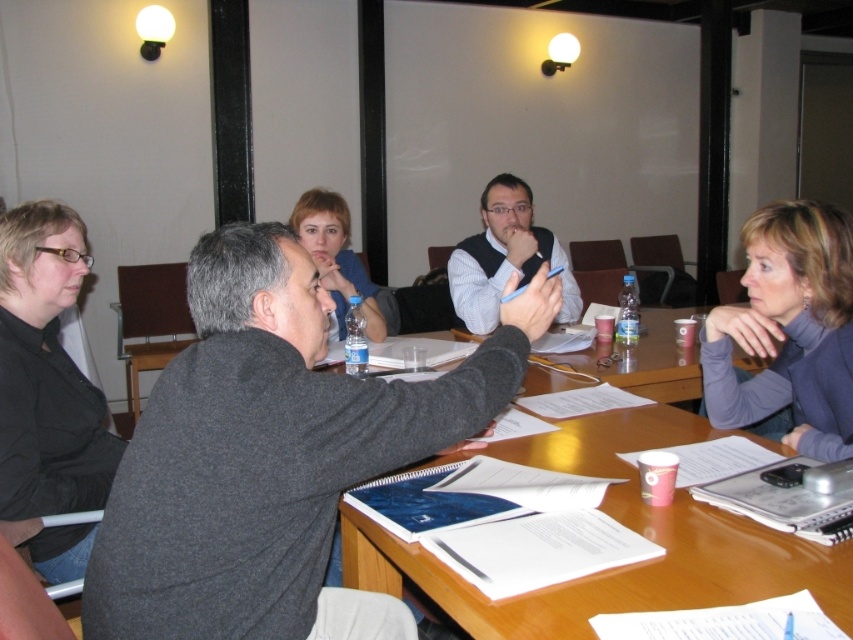
Does wooden table at center appear under matte blue shirt at center?

Yes.

Is wooden table at center bigger than matte blue shirt at center?

Correct, wooden table at center is larger in size than matte blue shirt at center.

Is point (654, 570) more distant than point (344, 273)?

That is False.

Image resolution: width=853 pixels, height=640 pixels. In order to click on wooden table at center in this screenshot , I will do `click(622, 524)`.

How far apart are purple turtleneck sweater at upper right and matte blue shirt at center?

The distance of purple turtleneck sweater at upper right from matte blue shirt at center is 3.98 feet.

Which of these two, purple turtleneck sweater at upper right or matte blue shirt at center, stands shorter?

matte blue shirt at center is shorter.

Locate an element on the screen. The height and width of the screenshot is (640, 853). purple turtleneck sweater at upper right is located at coordinates (788, 330).

Which is in front, point (596, 602) or point (51, 458)?

Positioned in front is point (596, 602).

Who is more distant from viewer, (468, 605) or (73, 492)?

Positioned behind is point (73, 492).

Find the location of a particular element. The height and width of the screenshot is (640, 853). wooden table at center is located at coordinates (622, 524).